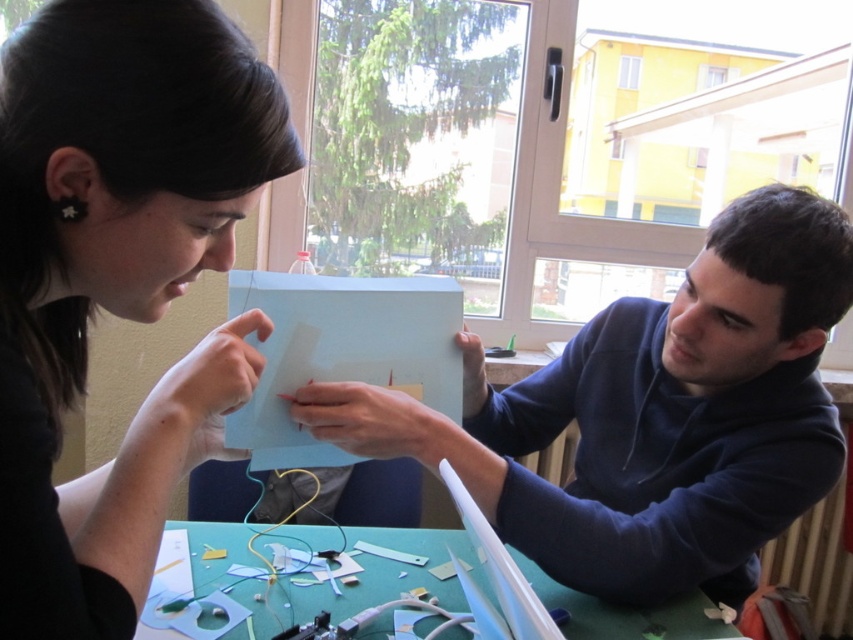
Question: Is blue matte paper at center wider than green paper at lower center?

Choices:
 (A) no
 (B) yes

Answer: (A)

Question: Which point appears farthest from the camera in this image?

Choices:
 (A) (12, 387)
 (B) (245, 595)
 (C) (743, 196)

Answer: (B)

Question: Does blue matte paper at center have a larger size compared to green paper at lower center?

Choices:
 (A) yes
 (B) no

Answer: (A)

Question: Which of the following is the closest to the observer?

Choices:
 (A) (245, 397)
 (B) (354, 609)
 (C) (677, 328)

Answer: (A)

Question: Which point is farther from the camera taking this photo?

Choices:
 (A) (631, 544)
 (B) (704, 628)
 (C) (109, 72)

Answer: (B)

Question: Is matte black paper at upper left bigger than green paper at lower center?

Choices:
 (A) no
 (B) yes

Answer: (B)